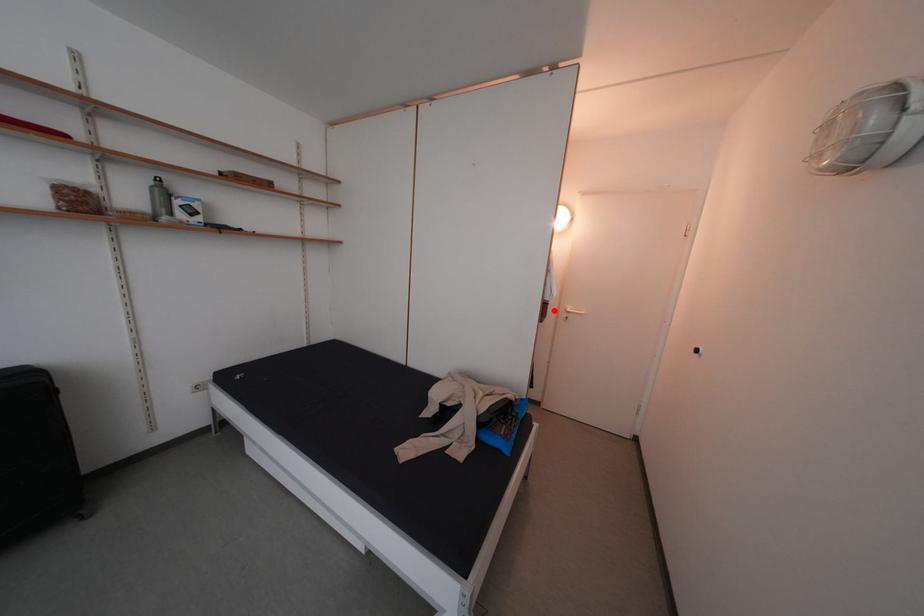
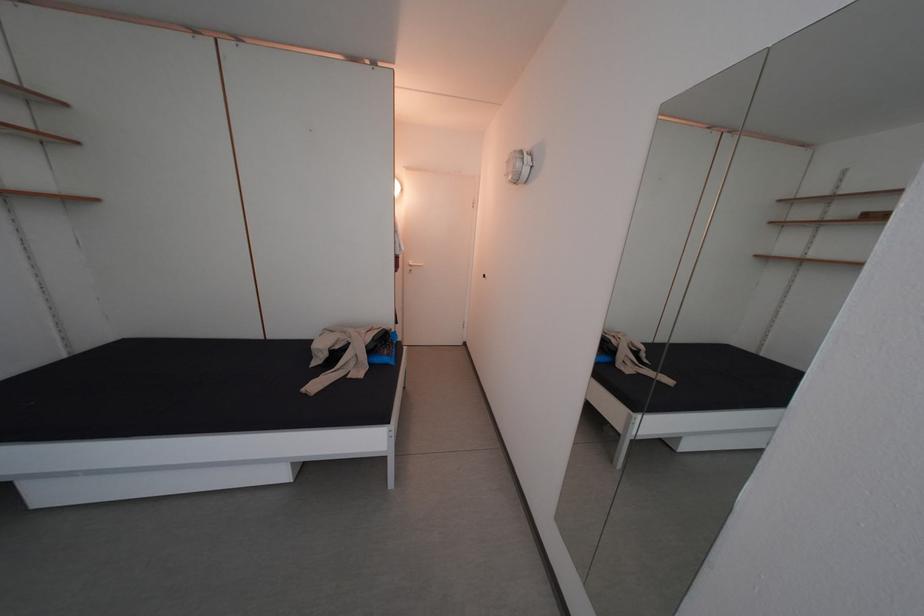
Question: I am providing you with two images of the same scene from different viewpoints. Given a red point in image1, look at the same physical point in image2. Is it:

Choices:
 (A) Closer to the viewpoint
 (B) Farther from the viewpoint

Answer: (A)